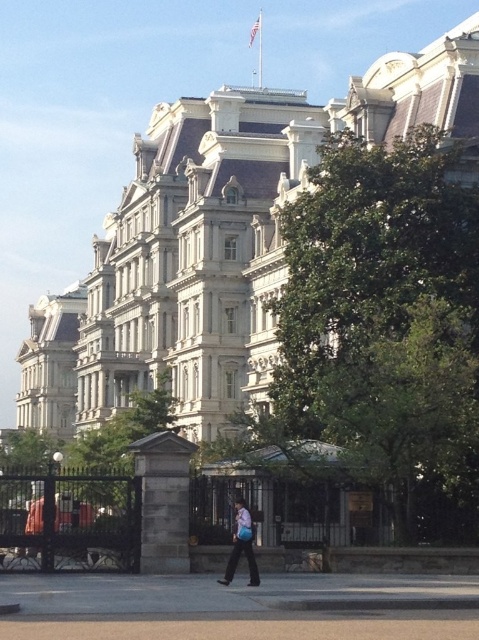
Which of these two, gray concrete pavement at lower center or light blue fabric bag at center, stands taller?

light blue fabric bag at center is taller.

Is gray concrete pavement at lower center above light blue fabric bag at center?

Actually, gray concrete pavement at lower center is below light blue fabric bag at center.

Between point (171, 611) and point (230, 563), which one is positioned behind?

Point (230, 563)

This screenshot has width=479, height=640. I want to click on gray concrete pavement at lower center, so click(240, 608).

Is white stone building at center wider than light blue fabric bag at center?

Yes.

Between point (175, 358) and point (250, 540), which one is positioned behind?

The point (175, 358) is more distant.

Locate an element on the screen. white stone building at center is located at coordinates (217, 243).

The width and height of the screenshot is (479, 640). Identify the location of white stone building at center. (217, 243).

Who is positioned more to the right, white stone building at center or gray concrete pavement at lower center?

gray concrete pavement at lower center is more to the right.

Between white stone building at center and gray concrete pavement at lower center, which one has more height?

With more height is white stone building at center.

At what (x,y) coordinates should I click in order to perform the action: click on white stone building at center. Please return your answer as a coordinate pair (x, y). This screenshot has height=640, width=479. Looking at the image, I should click on (217, 243).